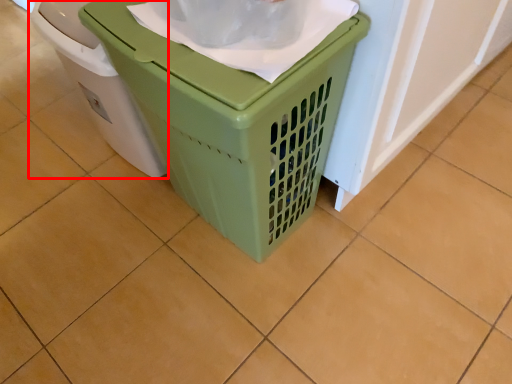
Question: From the image's perspective, where is waste container (annotated by the red box) located in relation to waste container in the image?

Choices:
 (A) below
 (B) above

Answer: (B)